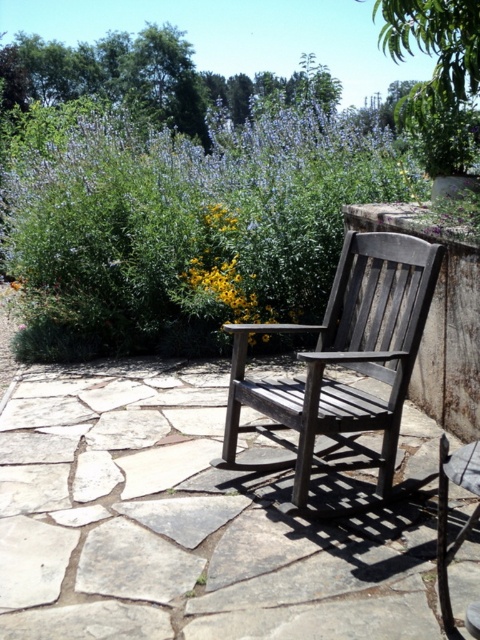
Is point (360, 241) farther from viewer compared to point (203, 275)?

No.

From the picture: Who is positioned more to the right, dark gray wood chair at center or yellow matte flower at center?

dark gray wood chair at center is more to the right.

In order to click on dark gray wood chair at center in this screenshot , I will do `click(344, 362)`.